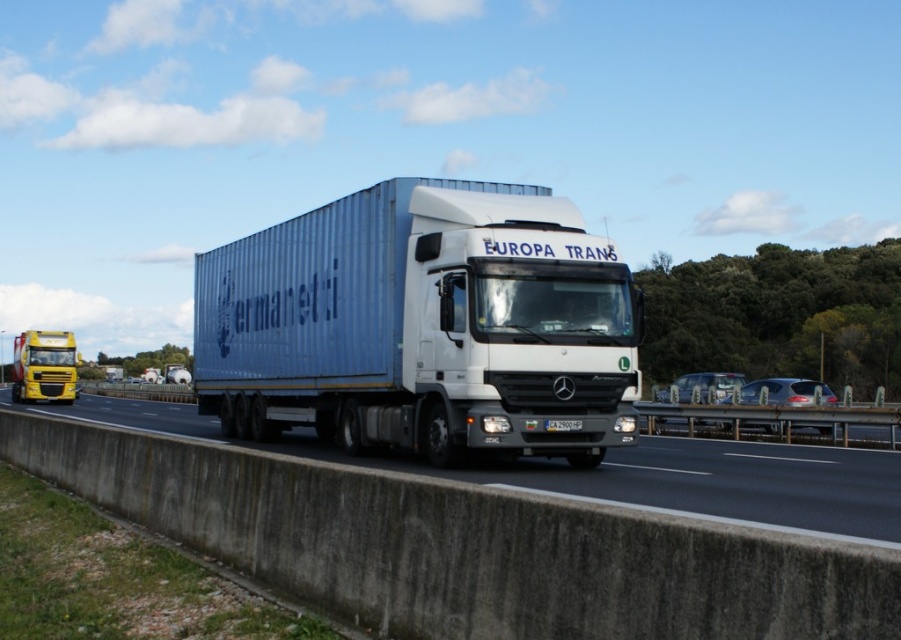
Between white glossy trailer truck at center and metallic yellow truck at left, which one is positioned lower?

metallic yellow truck at left is below.

The image size is (901, 640). In order to click on white glossy trailer truck at center in this screenshot , I will do `click(423, 324)`.

Based on the photo, is white glossy trailer truck at center below white glossy concrete barrier at lower center?

Actually, white glossy trailer truck at center is above white glossy concrete barrier at lower center.

Is white glossy trailer truck at center taller than white glossy concrete barrier at lower center?

Correct, white glossy trailer truck at center is much taller as white glossy concrete barrier at lower center.

Where is `white glossy trailer truck at center`? This screenshot has width=901, height=640. white glossy trailer truck at center is located at coordinates (423, 324).

In order to click on white glossy trailer truck at center in this screenshot , I will do `click(423, 324)`.

Is point (744, 451) positioned in front of point (30, 392)?

Yes, point (744, 451) is closer to viewer.

Consider the image. Which of these two, white glossy concrete barrier at lower center or metallic yellow truck at left, stands taller?

metallic yellow truck at left

The image size is (901, 640). In order to click on white glossy concrete barrier at lower center in this screenshot , I will do `click(695, 481)`.